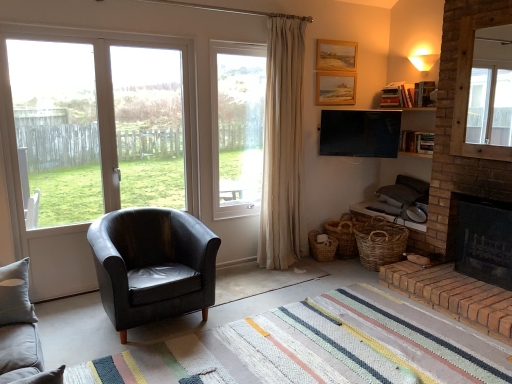
This screenshot has height=384, width=512. I want to click on free space above brown brick fireplace at lower right, the 2th fireplace positioned from the top (from a real-world perspective), so click(460, 279).